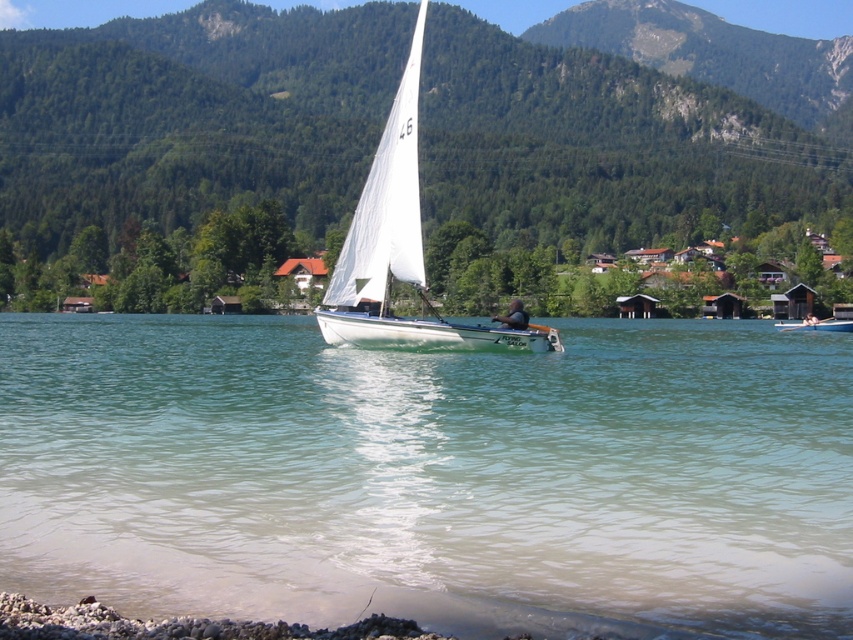
Between smooth pebbles at lower left and black fabric person at center, which one is positioned higher?

black fabric person at center is higher up.

Between point (204, 618) and point (506, 316), which one is positioned behind?

Point (506, 316)

You are a GUI agent. You are given a task and a screenshot of the screen. Output one action in this format:
    pyautogui.click(x=<x>, y=<y>)
    Task: Click on the smooth pebbles at lower left
    The height and width of the screenshot is (640, 853).
    Given the screenshot: What is the action you would take?
    pyautogui.click(x=177, y=625)

Identify the location of smooth pebbles at lower left. The image size is (853, 640). (177, 625).

Can you confirm if clear water at center is smaller than white matte sailboat at center?

Correct, clear water at center occupies less space than white matte sailboat at center.

Is clear water at center positioned at the back of white matte sailboat at center?

No, clear water at center is in front of white matte sailboat at center.

Between point (300, 524) and point (402, 253), which one is positioned in front?

Positioned in front is point (300, 524).

Locate an element on the screen. Image resolution: width=853 pixels, height=640 pixels. clear water at center is located at coordinates (431, 474).

Is white sailboat at center taller than black fabric person at center?

Yes, white sailboat at center is taller than black fabric person at center.

Locate an element on the screen. Image resolution: width=853 pixels, height=640 pixels. white sailboat at center is located at coordinates (816, 324).

Locate an element on the screen. white sailboat at center is located at coordinates (816, 324).